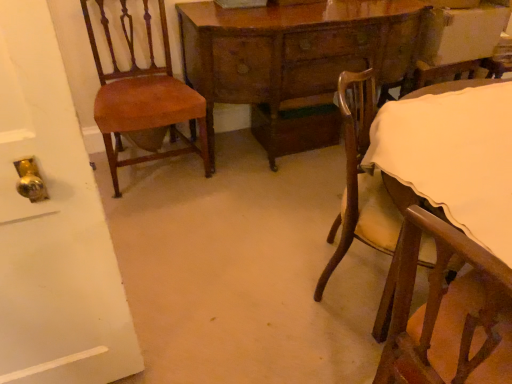
Question: From a real-world perspective, is wooden table at center positioned above or below wooden chair with cream cushion at lower right, which ranks as the 1th chair in right-to-left order?

Choices:
 (A) below
 (B) above

Answer: (B)

Question: Is wooden table at center spatially inside wooden chair with cream cushion at lower right, which is counted as the second chair, starting from the left, or outside of it?

Choices:
 (A) outside
 (B) inside

Answer: (A)

Question: Considering the real-world distances, which object is closest to the wooden chair with cream cushion at lower right, which ranks as the 1th chair in right-to-left order?

Choices:
 (A) mahogany wood chair at left, which ranks as the 2th chair in right-to-left order
 (B) wooden table at center

Answer: (B)

Question: Which is farther from the mahogany wood chair at left, which ranks as the first chair in left-to-right order?

Choices:
 (A) wooden table at center
 (B) wooden chair with cream cushion at lower right, which ranks as the 1th chair in right-to-left order

Answer: (B)